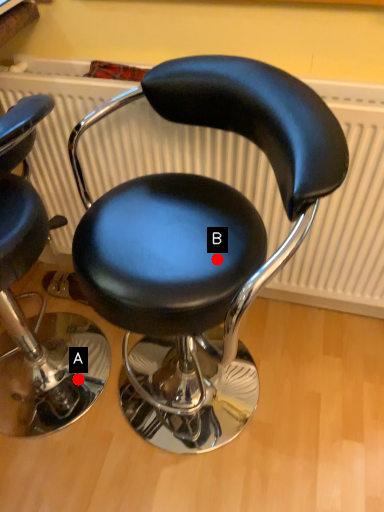
Question: Two points are circled on the image, labeled by A and B beside each circle. Which of the following is the closest to the observer?

Choices:
 (A) A is closer
 (B) B is closer

Answer: (B)